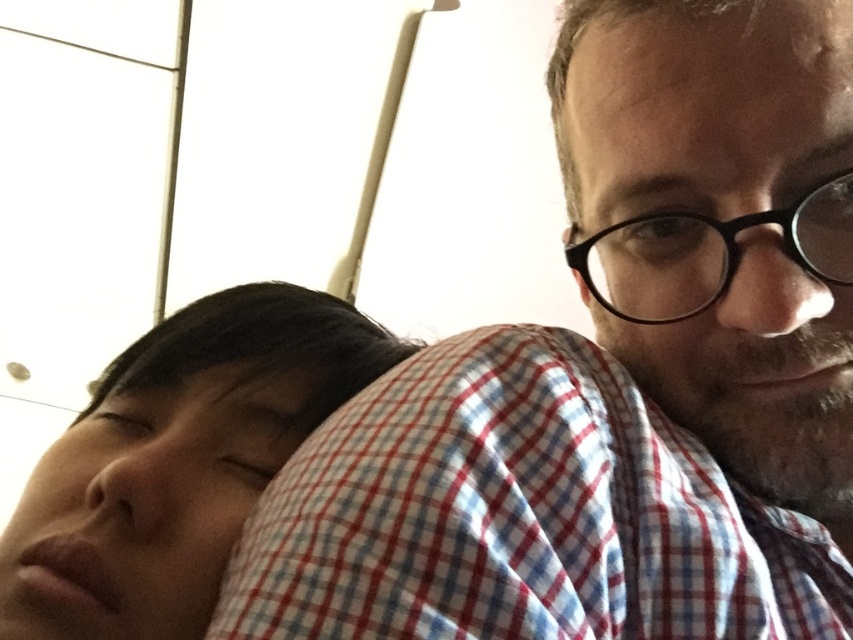
Question: Where is smooth skin face at lower left located in relation to black plastic glasses at upper right in the image?

Choices:
 (A) right
 (B) left

Answer: (B)

Question: Estimate the real-world distances between objects in this image. Which object is closer to the smooth skin face at lower left?

Choices:
 (A) matte checkered shirt at right
 (B) red checkered fabric pillow at upper center

Answer: (B)

Question: Which object is the closest to the matte checkered shirt at right?

Choices:
 (A) red checkered fabric pillow at upper center
 (B) smooth skin face at lower left

Answer: (A)

Question: Does matte checkered shirt at right come in front of black plastic glasses at upper right?

Choices:
 (A) no
 (B) yes

Answer: (A)

Question: Is the position of matte checkered shirt at right less distant than that of smooth skin face at lower left?

Choices:
 (A) no
 (B) yes

Answer: (B)

Question: Which point appears closest to the camera in this image?

Choices:
 (A) (640, 177)
 (B) (486, 348)
 (C) (100, 417)
 (D) (633, 301)

Answer: (B)